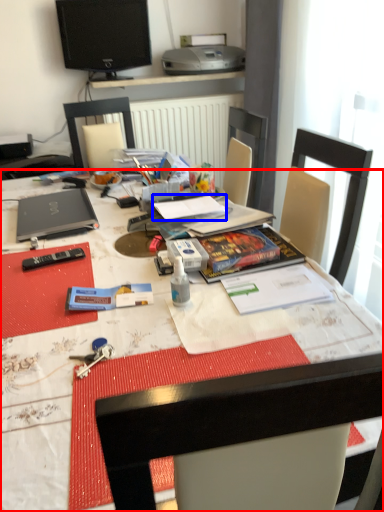
Question: Which object appears farthest to the camera in this image, desk (highlighted by a red box) or notebook (highlighted by a blue box)?

Choices:
 (A) desk
 (B) notebook

Answer: (B)